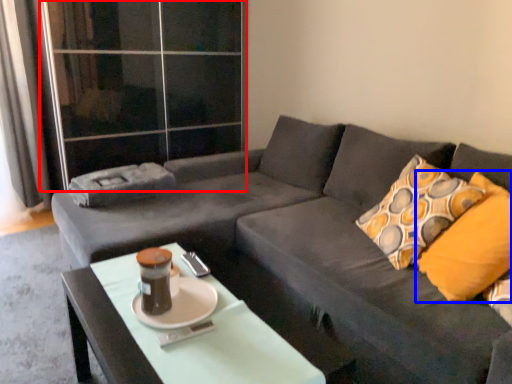
Question: Which object is further to the camera taking this photo, glass door (highlighted by a red box) or throw pillow (highlighted by a blue box)?

Choices:
 (A) glass door
 (B) throw pillow

Answer: (A)